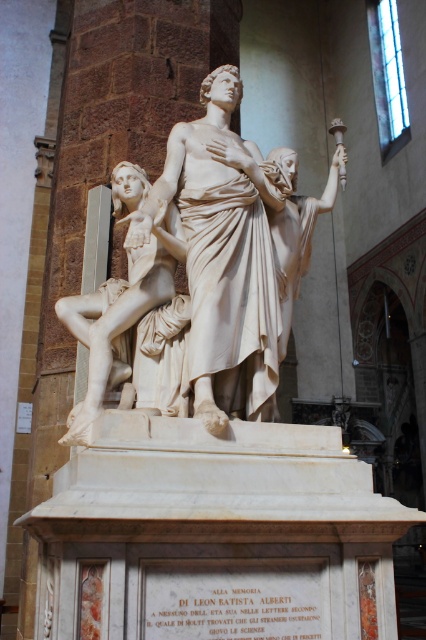
You are an art conservator assessing the space between two statues in the cathedral. The white marble statue at center and the white marble statue at left are positioned in a narrow corridor. If the corridor is only 2 meters wide, can both statues fit side by side without overlapping?

The white marble statue at center has a lesser width compared to white marble statue at left. The total width of both statues would be the sum of their widths. Since the corridor is only 2 meters wide, we need to know the individual widths to determine if they fit. However, the provided information only states that the center statue is narrower than the left one, but without specific measurements, it is impossible to confirm if their combined width exceeds the corridor.

You are an art student standing in the grand interior space. You want to take a photo of the white marble statue at center without the white marble statue at left appearing in the background. Based on their positions, is this possible?

Yes, because the white marble statue at center is in front of the white marble statue at left, so you can position yourself so that the statue at center blocks the view of the one at left in the background.